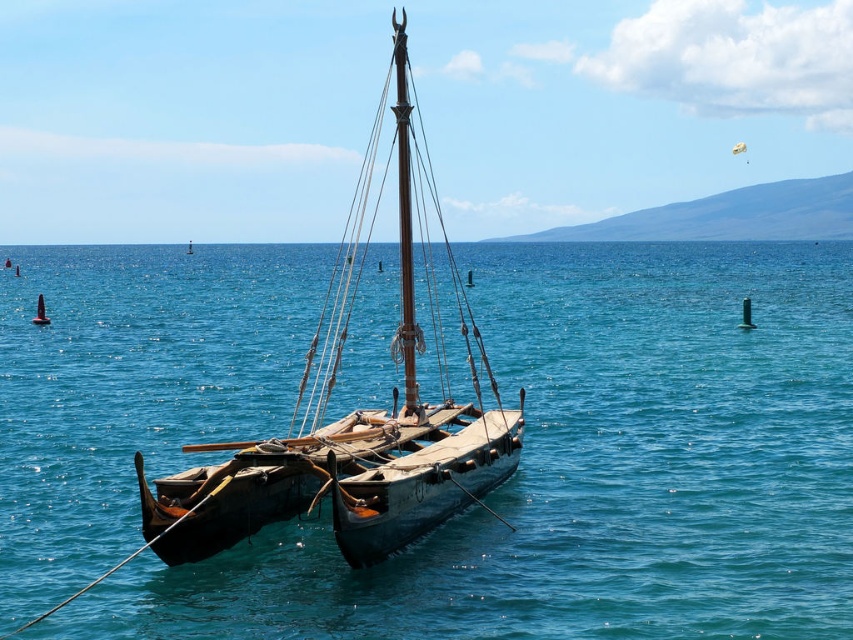
Question: Which of the following is the closest to the observer?

Choices:
 (A) wooden sailboat at center
 (B) transparent wooden boat at center

Answer: (B)

Question: Is transparent wooden boat at center smaller than wooden sailboat at center?

Choices:
 (A) no
 (B) yes

Answer: (A)

Question: Among these points, which one is farthest from the camera?

Choices:
 (A) (409, 244)
 (B) (223, 388)

Answer: (B)

Question: Is transparent wooden boat at center above wooden sailboat at center?

Choices:
 (A) yes
 (B) no

Answer: (B)

Question: Can you confirm if transparent wooden boat at center is positioned to the left of wooden sailboat at center?

Choices:
 (A) yes
 (B) no

Answer: (A)

Question: Which object appears farthest from the camera in this image?

Choices:
 (A) wooden sailboat at center
 (B) transparent wooden boat at center

Answer: (A)